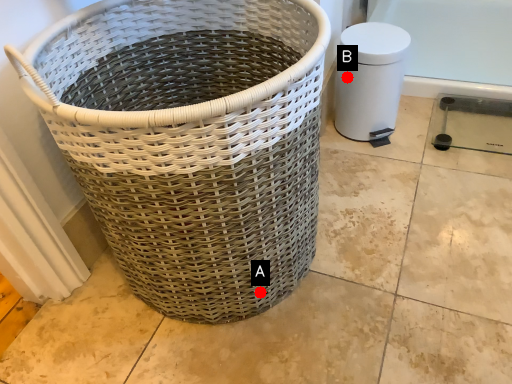
Question: Two points are circled on the image, labeled by A and B beside each circle. Which point is closer to the camera?

Choices:
 (A) A is closer
 (B) B is closer

Answer: (A)